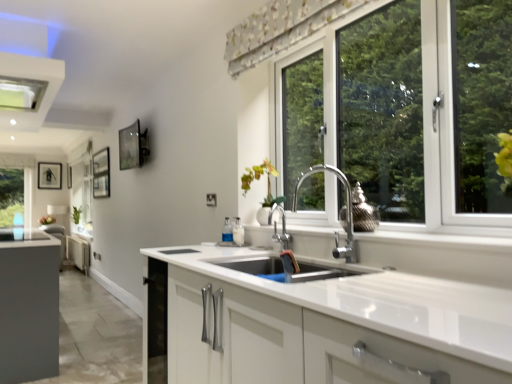
Question: From the image's perspective, relative to white matte cabinet at center, is metallic glass picture frame at upper left, the 2th picture frame from the left, above or below?

Choices:
 (A) above
 (B) below

Answer: (A)

Question: From a real-world perspective, is metallic glass picture frame at upper left, the 2th picture frame from the left, positioned above or below white matte cabinet at center?

Choices:
 (A) above
 (B) below

Answer: (A)

Question: Considering the real-world distances, which object is farthest from the green matte plant at left?

Choices:
 (A) matte black picture frame at left, which is counted as the 2th picture frame, starting from the right
 (B) floral fabric curtain at upper center
 (C) metallic glass picture frame at upper left, acting as the 2th picture frame starting from the back
 (D) white plastic exhaust hood at upper left
 (E) white glossy vase at center

Answer: (B)

Question: Estimate the real-world distances between objects in this image. Which object is farther from the green matte plant at left?

Choices:
 (A) metallic glass picture frame at upper left, placed as the 1th picture frame when sorted from right to left
 (B) white plastic exhaust hood at upper left
 (C) floral fabric curtain at upper center
 (D) matte black picture frame at left, the second picture frame when ordered from front to back
 (E) white matte cabinet at center

Answer: (E)